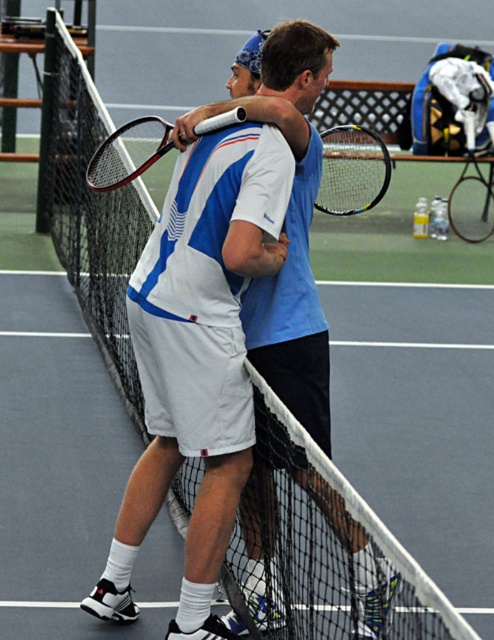
Question: From the image, what is the correct spatial relationship of white matte tennis racket at upper center in relation to black matte tennis racket at center?

Choices:
 (A) left
 (B) right

Answer: (A)

Question: Is white matte tennis racket at upper center wider than black rubber tennis racket at center?

Choices:
 (A) no
 (B) yes

Answer: (B)

Question: Which point is closer to the camera taking this photo?

Choices:
 (A) (166, 145)
 (B) (492, 202)
 (C) (204, 593)
 (D) (386, 148)

Answer: (C)

Question: Can you confirm if matte black tennis racket at upper center is positioned to the right of black matte tennis racket at center?

Choices:
 (A) yes
 (B) no

Answer: (B)

Question: Which point is closer to the camera?

Choices:
 (A) white matte tennis racket at upper center
 (B) matte black tennis racket at upper center
 (C) black rubber tennis racket at center

Answer: (A)

Question: Which is farther from the matte black tennis racket at upper center?

Choices:
 (A) black rubber tennis racket at center
 (B) white matte tennis racket at upper center
 (C) black matte tennis racket at center

Answer: (C)